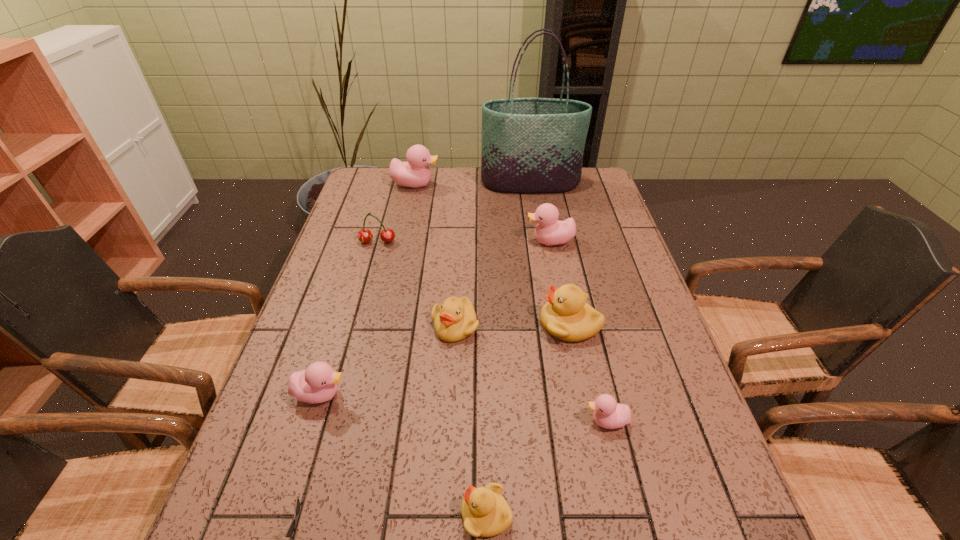
The image size is (960, 540). In order to click on object that is at the far right corner in this screenshot , I will do `click(529, 145)`.

I want to click on vacant space at the left edge of the desktop, so click(248, 476).

Identify the location of blank area at the right edge. The image size is (960, 540). (678, 491).

In order to click on free space at the far left corner of the desktop in this screenshot , I will do `click(379, 178)`.

The width and height of the screenshot is (960, 540). I want to click on free space that is in between the smallest pink duckling and the cherry, so click(x=492, y=332).

Locate an element on the screen. Image resolution: width=960 pixels, height=540 pixels. free spot between the biggest pink duckling and the tote bag is located at coordinates (473, 184).

What are the coordinates of `vacant space that is in between the second smallest pink duckling and the tallest object` in the screenshot? It's located at (425, 289).

The height and width of the screenshot is (540, 960). I want to click on free point between the second smallest yellow duckling and the third smallest pink duckling, so click(503, 284).

Identify which object is the third closest to the second farthest pink duckling. Please provide its 2D coordinates. Your answer should be formatted as a tuple, i.e. [(x, y)], where the tuple contains the x and y coordinates of a point satisfying the conditions above.

[(455, 319)]

Identify which object is the closest to the smallest pink duckling. Please provide its 2D coordinates. Your answer should be formatted as a tuple, i.e. [(x, y)], where the tuple contains the x and y coordinates of a point satisfying the conditions above.

[(566, 316)]